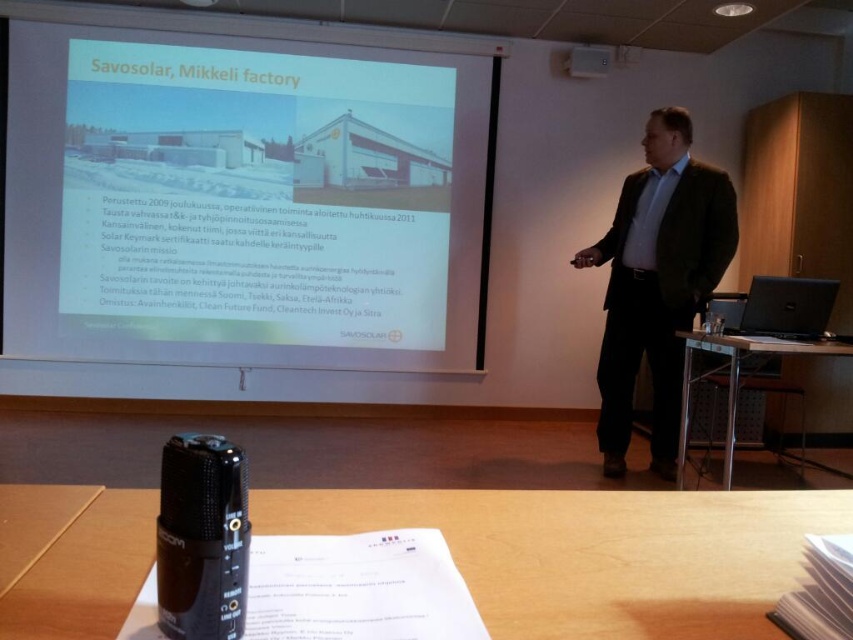
Question: Is white matte projector screen at upper center smaller than wooden table at lower center?

Choices:
 (A) no
 (B) yes

Answer: (A)

Question: Which of these objects is positioned farthest from the metallic silver table at lower right?

Choices:
 (A) green matte suit at center
 (B) matte black projector at upper center
 (C) white matte projector screen at upper center
 (D) wooden table at lower center

Answer: (C)

Question: Does wooden table at lower center have a larger size compared to metallic silver table at lower right?

Choices:
 (A) yes
 (B) no

Answer: (B)

Question: Which object is positioned farthest from the wooden table at lower center?

Choices:
 (A) green matte suit at center
 (B) matte black projector at upper center
 (C) white matte projector screen at upper center

Answer: (B)

Question: Which object is closer to the camera taking this photo?

Choices:
 (A) metallic silver table at lower right
 (B) wooden table at lower center
 (C) matte black projector at upper center

Answer: (B)

Question: Is wooden table at lower center to the left of metallic silver table at lower right from the viewer's perspective?

Choices:
 (A) no
 (B) yes

Answer: (B)